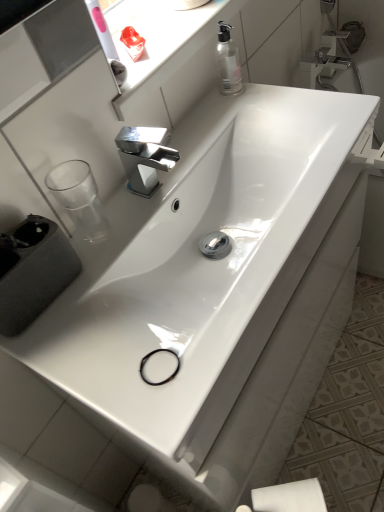
Locate an element on the screen. The image size is (384, 512). empty space that is ontop of transparent plastic window sill at upper center (from a real-world perspective) is located at coordinates (161, 27).